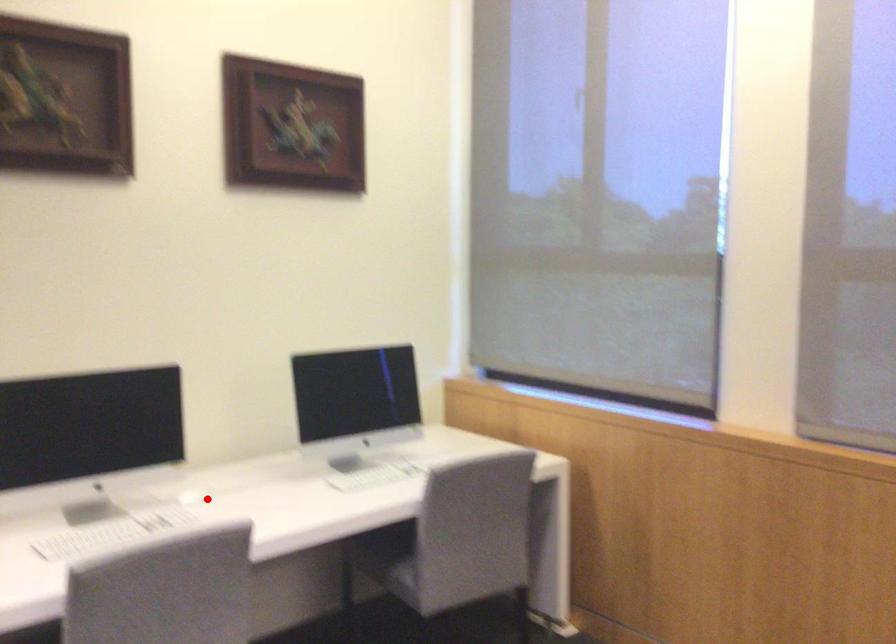
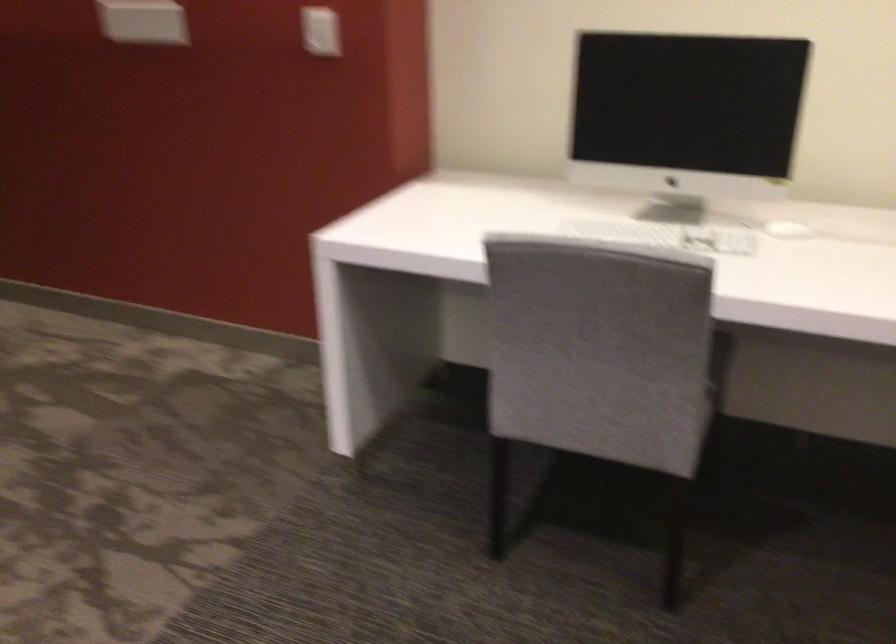
Where in the second image is the point corresponding to the highlighted location from the first image?

(786, 230)